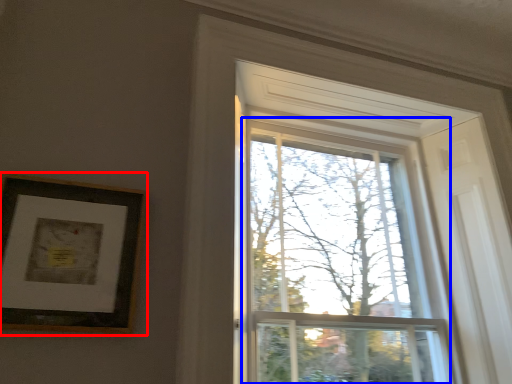
Question: Which of the following is the closest to the observer, picture frame (highlighted by a red box) or glass window (highlighted by a blue box)?

Choices:
 (A) picture frame
 (B) glass window

Answer: (A)